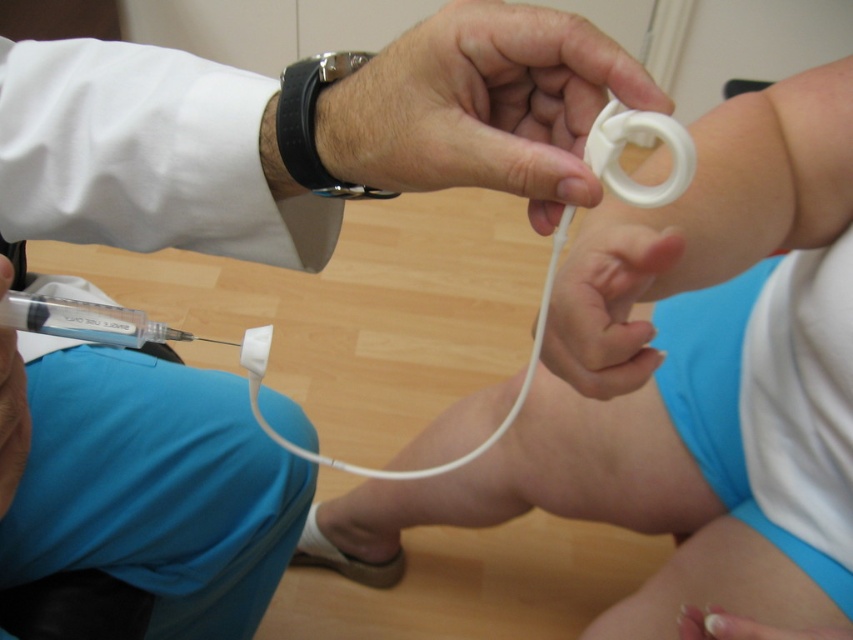
You are a healthcare professional standing in the clinical setting depicted. You need to place a medical tool that is 40 centimeters long onto the white plastic ring at upper center. Can you fit it there?

The distance between the white plastic ring at upper center and the viewer is 38.78 centimeters, which is shorter than the tool length of 40 centimeters. Therefore, the tool cannot be placed on the white plastic ring at upper center.

Based on the scene described, which object is positioned lower in the image? The white plastic ring at upper center or the white matte cord at lower center?

The white plastic ring at upper center is below the white matte cord at lower center, so the white plastic ring at upper center is positioned lower in the image.

You are a nurse in a clinical setting. You need to determine which ring to use for securing the syringe. The syringe has a label indicating it requires a plastic ring. Which ring should you choose between the white plastic ring at upper center and the white matte ring at upper center?

You should choose the white plastic ring at upper center because it is made of plastic, as specified by the syringe label, and it is positioned to the right of the white matte ring at upper center.